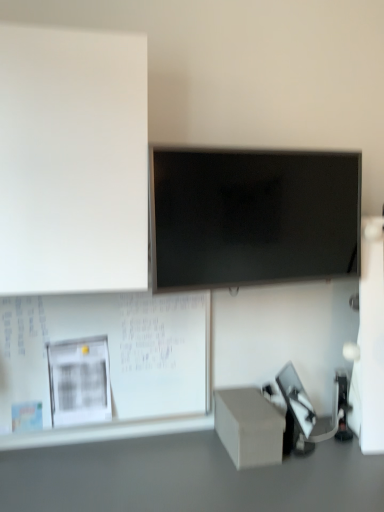
You are a GUI agent. You are given a task and a screenshot of the screen. Output one action in this format:
    pyautogui.click(x=<x>, y=<y>)
    Task: Click on the free location in front of matte gray cube at lower right
    This screenshot has height=512, width=384.
    Given the screenshot: What is the action you would take?
    pyautogui.click(x=262, y=485)